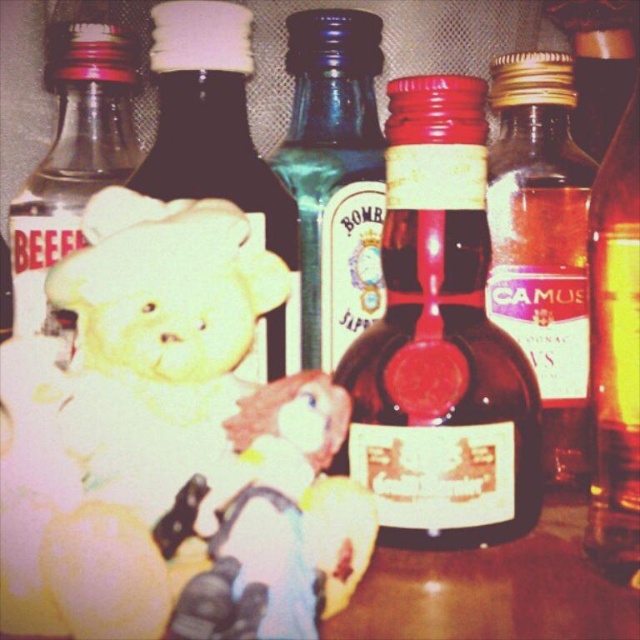
Question: Which of the following is the farthest from the observer?

Choices:
 (A) translucent glass bottle at center
 (B) yellow plush toy at center

Answer: (A)

Question: Estimate the real-world distances between objects in this image. Which object is farther from the shiny brown bottle at center?

Choices:
 (A) translucent amber glass bottle at right
 (B) white matte bear at left
 (C) translucent glass bottle at center
 (D) yellow plush toy at center

Answer: (D)

Question: Among these points, which one is nearest to the camera?

Choices:
 (A) (525, 77)
 (B) (602, 284)
 (C) (56, 166)

Answer: (B)

Question: Does shiny brown bottle at center have a lesser width compared to translucent glass bottle at center?

Choices:
 (A) yes
 (B) no

Answer: (B)

Question: Can you confirm if translucent amber glass bottle at right is positioned above clear glass bottle at left?

Choices:
 (A) no
 (B) yes

Answer: (A)

Question: Is shiny brown bottle at center to the right of translucent amber glass bottle at right from the viewer's perspective?

Choices:
 (A) yes
 (B) no

Answer: (B)